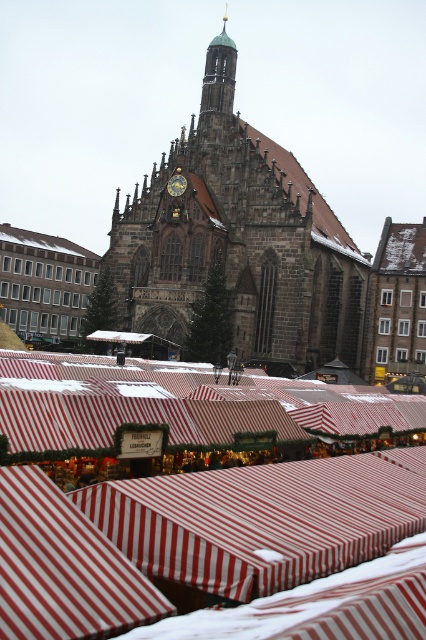
Question: Can you confirm if red striped awning at center is positioned to the right of dark brown stone church at center?

Choices:
 (A) no
 (B) yes

Answer: (B)

Question: In this image, where is red striped awning at center located relative to dark brown stone church at center?

Choices:
 (A) right
 (B) left

Answer: (A)

Question: Can you confirm if red striped awning at center is positioned below dark brown stone church at center?

Choices:
 (A) no
 (B) yes

Answer: (B)

Question: Which of the following is the farthest from the observer?

Choices:
 (A) (244, 214)
 (B) (394, 544)

Answer: (A)

Question: Which point is closer to the camera?

Choices:
 (A) dark brown stone church at center
 (B) red striped awning at center

Answer: (B)